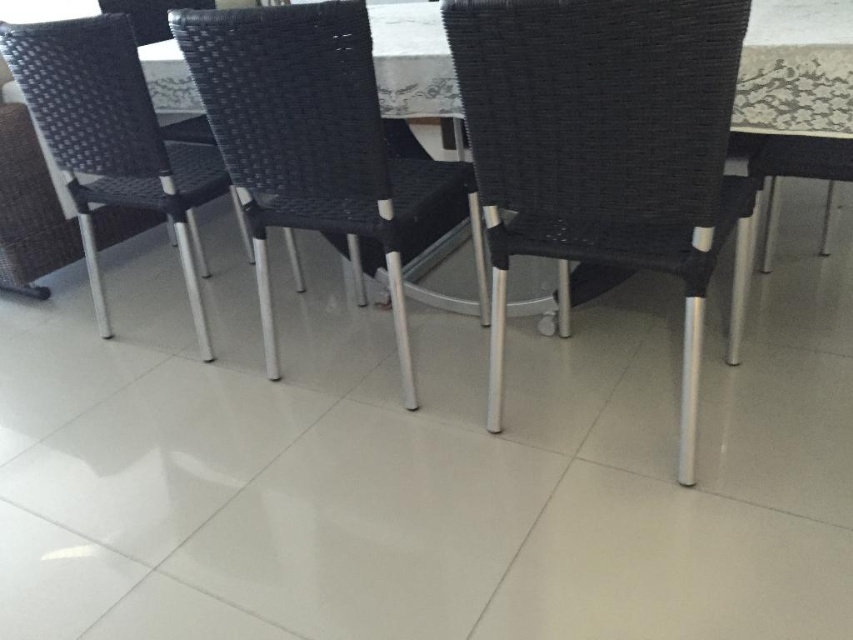
Does woven black chair at center have a larger size compared to black woven chair at center?

Indeed, woven black chair at center has a larger size compared to black woven chair at center.

Does point (285, 161) lie behind point (143, 102)?

No, it is not.

Does point (229, 12) lie in front of point (102, 81)?

Yes, point (229, 12) is closer to viewer.

The width and height of the screenshot is (853, 640). In order to click on woven black chair at center in this screenshot , I will do `click(312, 140)`.

Which is below, black woven chair at center or black woven chair at upper right?

Positioned lower is black woven chair at center.

Is point (186, 145) positioned before point (779, 179)?

That is False.

Is point (77, 32) positioned before point (838, 106)?

That is False.

Identify the location of black woven chair at center. (115, 140).

Which is more to the left, matte black chair at center or woven black chair at center?

From the viewer's perspective, woven black chair at center appears more on the left side.

The image size is (853, 640). Identify the location of matte black chair at center. (604, 147).

You are a GUI agent. You are given a task and a screenshot of the screen. Output one action in this format:
    pyautogui.click(x=<x>, y=<y>)
    Task: Click on the matte black chair at center
    The image size is (853, 640).
    Given the screenshot: What is the action you would take?
    pyautogui.click(x=604, y=147)